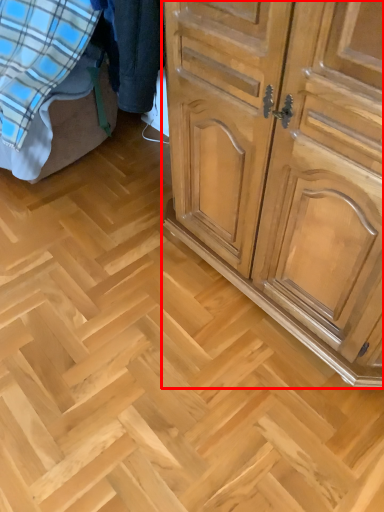
Question: From the image's perspective, where is chest of drawers (annotated by the red box) located relative to bed?

Choices:
 (A) below
 (B) above

Answer: (A)